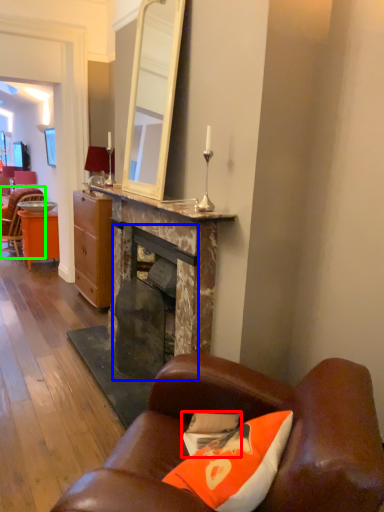
Question: Which object is positioned farthest from pillow (highlighted by a red box)? Select from fireplace (highlighted by a blue box) and chair (highlighted by a green box).

Choices:
 (A) fireplace
 (B) chair

Answer: (B)